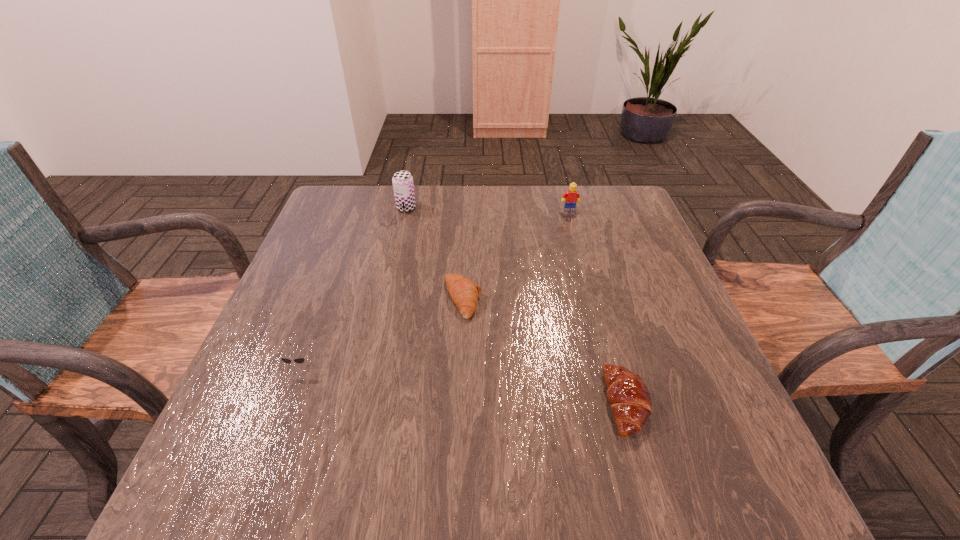
The height and width of the screenshot is (540, 960). In order to click on vacant area that lies between the sunglasses and the beer can in this screenshot , I will do `click(354, 286)`.

Where is `free space between the Lego and the tallest object`? free space between the Lego and the tallest object is located at coordinates (488, 209).

Image resolution: width=960 pixels, height=540 pixels. Identify the location of object that stands as the second closest to the leftmost object. (403, 186).

Choose which object is the fourth nearest neighbor to the nearer crescent roll. Please provide its 2D coordinates. Your answer should be formatted as a tuple, i.e. [(x, y)], where the tuple contains the x and y coordinates of a point satisfying the conditions above.

[(403, 186)]

You are a GUI agent. You are given a task and a screenshot of the screen. Output one action in this format:
    pyautogui.click(x=<x>, y=<y>)
    Task: Click on the vacant space that satisfies the following two spatial constraints: 1. in front of the lenses of the leftmost object; 2. on the left side of the nearer crescent roll
    
    Given the screenshot: What is the action you would take?
    pyautogui.click(x=287, y=403)

Find the location of a particular element. Image resolution: width=960 pixels, height=540 pixels. free space that satisfies the following two spatial constraints: 1. on the front-facing side of the Lego; 2. on the left side of the right crescent roll is located at coordinates pyautogui.click(x=622, y=403).

The image size is (960, 540). I want to click on free space that satisfies the following two spatial constraints: 1. on the front-facing side of the nearer crescent roll; 2. on the left side of the Lego, so click(622, 403).

The height and width of the screenshot is (540, 960). I want to click on free location that satisfies the following two spatial constraints: 1. on the front-facing side of the right crescent roll; 2. on the right side of the second tallest object, so click(x=622, y=403).

The height and width of the screenshot is (540, 960). What are the coordinates of `vacant space that satisfies the following two spatial constraints: 1. on the front-facing side of the second tallest object; 2. on the left side of the nearer crescent roll` in the screenshot? It's located at (622, 403).